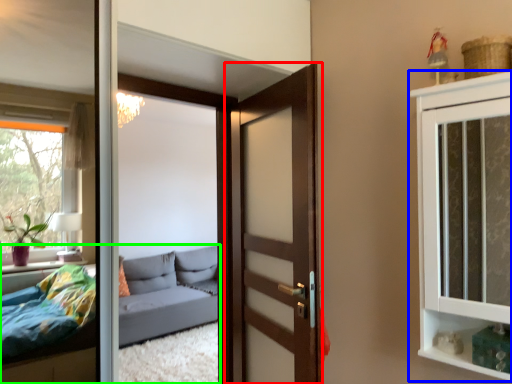
Question: Considering the real-world distances, which object is farthest from door (highlighted by a red box)? cabinetry (highlighted by a blue box) or studio couch (highlighted by a green box)?

Choices:
 (A) cabinetry
 (B) studio couch

Answer: (B)